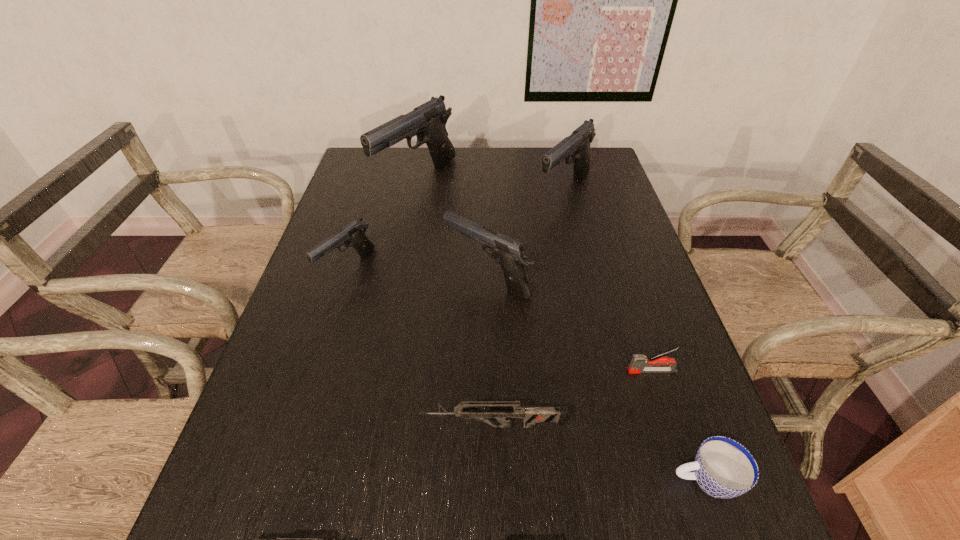
The image size is (960, 540). Identify the location of vacant space located on the handle side of the fifth farthest object. (505, 371).

Image resolution: width=960 pixels, height=540 pixels. What are the coordinates of `free space located on the handle side of the fifth farthest object` in the screenshot? It's located at (581, 371).

Image resolution: width=960 pixels, height=540 pixels. What are the coordinates of `free region located on the handle side of the fifth farthest object` in the screenshot? It's located at (562, 371).

You are a GUI agent. You are given a task and a screenshot of the screen. Output one action in this format:
    pyautogui.click(x=<x>, y=<y>)
    Task: Click on the blank space located 0.280m aimed along the barrel of the bigger grey gun
    This screenshot has height=540, width=960.
    Given the screenshot: What is the action you would take?
    pyautogui.click(x=275, y=426)

Where is `free location located 0.130m aimed along the barrel of the bigger grey gun`? The image size is (960, 540). free location located 0.130m aimed along the barrel of the bigger grey gun is located at coordinates (353, 426).

Find the location of a particular element. The width and height of the screenshot is (960, 540). free space located 0.310m aimed along the barrel of the bigger grey gun is located at coordinates (259, 426).

Identify the location of vacant region located 0.310m on the side of the cup with the handle. This screenshot has width=960, height=540. (492, 481).

The image size is (960, 540). In order to click on free spot located 0.390m on the side of the cup with the handle in this screenshot , I will do `click(446, 481)`.

In order to click on vacant space located on the side of the cup with the handle in this screenshot , I will do `click(579, 481)`.

Locate an element on the screen. gun located at the right edge is located at coordinates coord(577,145).